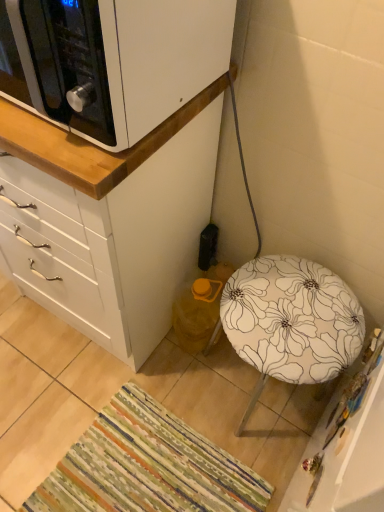
Question: Does white matte cabinet at upper left have a lesser width compared to black plastic electric outlet at lower center?

Choices:
 (A) no
 (B) yes

Answer: (A)

Question: Would you say white matte cabinet at upper left is outside black plastic electric outlet at lower center?

Choices:
 (A) yes
 (B) no

Answer: (A)

Question: Is white matte cabinet at upper left to the right of black plastic electric outlet at lower center from the viewer's perspective?

Choices:
 (A) no
 (B) yes

Answer: (A)

Question: Is white matte cabinet at upper left next to black plastic electric outlet at lower center and touching it?

Choices:
 (A) no
 (B) yes

Answer: (A)

Question: Can you confirm if white matte cabinet at upper left is shorter than black plastic electric outlet at lower center?

Choices:
 (A) yes
 (B) no

Answer: (B)

Question: Is white matte cabinet at upper left far from black plastic electric outlet at lower center?

Choices:
 (A) yes
 (B) no

Answer: (B)

Question: Considering the relative sizes of white floral fabric stool at lower right and black plastic electric outlet at lower center in the image provided, is white floral fabric stool at lower right thinner than black plastic electric outlet at lower center?

Choices:
 (A) yes
 (B) no

Answer: (B)

Question: Is white floral fabric stool at lower right smaller than black plastic electric outlet at lower center?

Choices:
 (A) yes
 (B) no

Answer: (B)

Question: Is white floral fabric stool at lower right further to the viewer compared to black plastic electric outlet at lower center?

Choices:
 (A) no
 (B) yes

Answer: (A)

Question: Is white floral fabric stool at lower right facing towards black plastic electric outlet at lower center?

Choices:
 (A) yes
 (B) no

Answer: (B)

Question: From the image's perspective, is white floral fabric stool at lower right above black plastic electric outlet at lower center?

Choices:
 (A) no
 (B) yes

Answer: (A)

Question: Is white floral fabric stool at lower right at the right side of black plastic electric outlet at lower center?

Choices:
 (A) yes
 (B) no

Answer: (A)

Question: Is multicolored woven mat at lower left to the right of white floral fabric stool at lower right from the viewer's perspective?

Choices:
 (A) yes
 (B) no

Answer: (B)